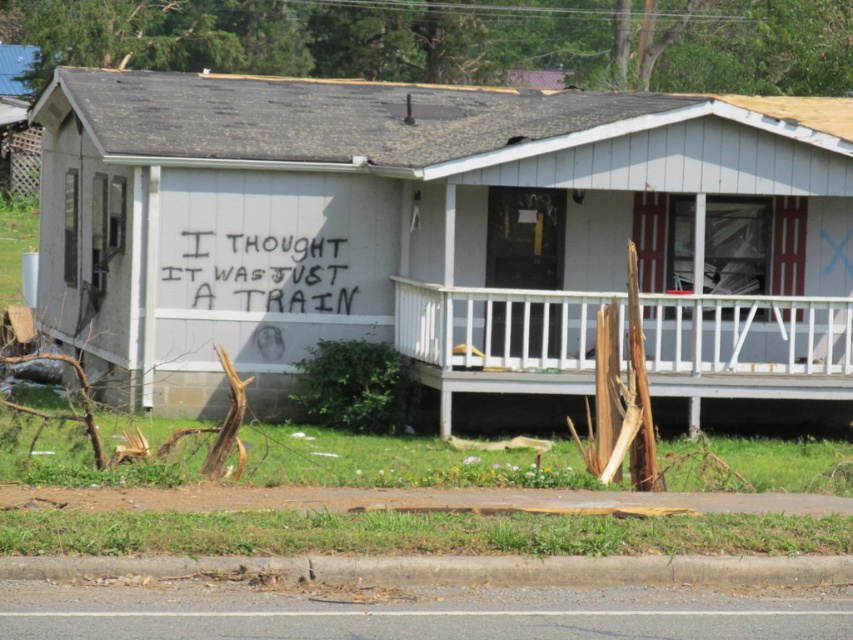
Question: Which object is farther from the camera taking this photo?

Choices:
 (A) white wooden porch at lower center
 (B) black spray paint graffiti at center

Answer: (B)

Question: Is white wooden porch at lower center to the left of black spray paint graffiti at center from the viewer's perspective?

Choices:
 (A) no
 (B) yes

Answer: (A)

Question: Which object is farther from the camera taking this photo?

Choices:
 (A) black spray paint graffiti at center
 (B) white wooden porch at lower center

Answer: (A)

Question: Is white wooden porch at lower center positioned at the back of black spray paint graffiti at center?

Choices:
 (A) yes
 (B) no

Answer: (B)

Question: Does white wooden porch at lower center appear on the left side of black spray paint graffiti at center?

Choices:
 (A) no
 (B) yes

Answer: (A)